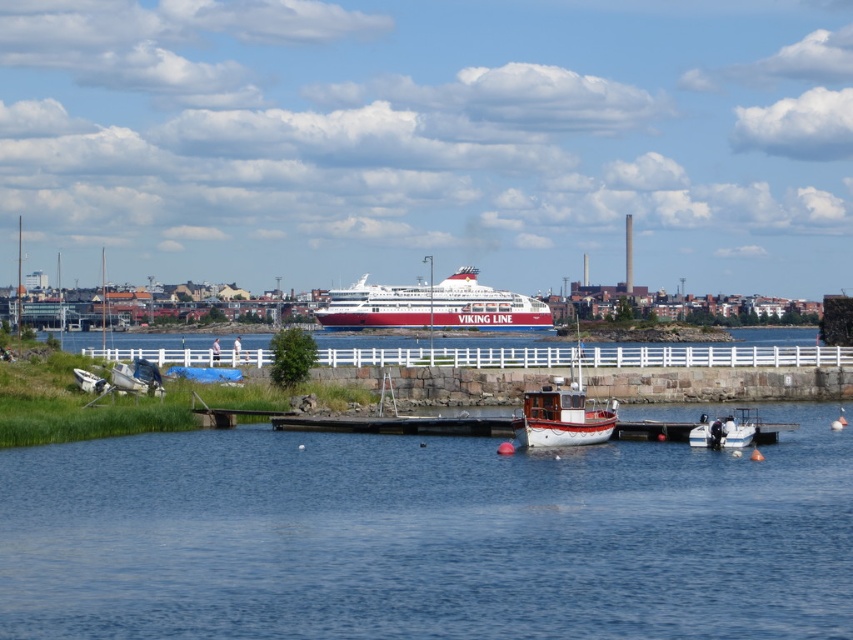
You are standing at the wooden pier and want to throw a small buoy to a friend who is on the boat labeled VIKING LINE. The coordinates of your position are point [631,604] and the coordinates of the boat are point [457,289]. Which point is closer to you?

Point [631,604] is in front of point [457,289], so the point closer to you is point [631,604].